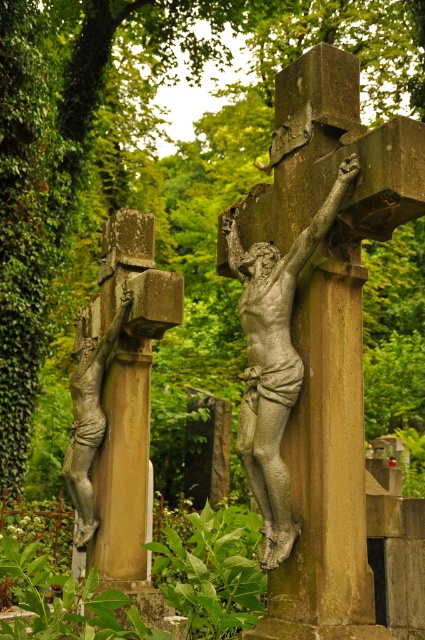
You are a tour guide explaining the cemetery to visitors. You point out the silver textured crucifix at center and the bronze statue of crucifixion figure at left. Which one is taller?

The silver textured crucifix at center is much taller than the bronze statue of crucifixion figure at left.

Consider the image. You are standing in a cemetery and see two points marked on the ground at coordinates point (x=286, y=486) and point (x=79, y=490). If you want to walk from the first point to the second, which direction should you move relative to the larger crucifix?

You should move towards the direction away from the larger crucifix because point (x=286, y=486) is in front of point (x=79, y=490).